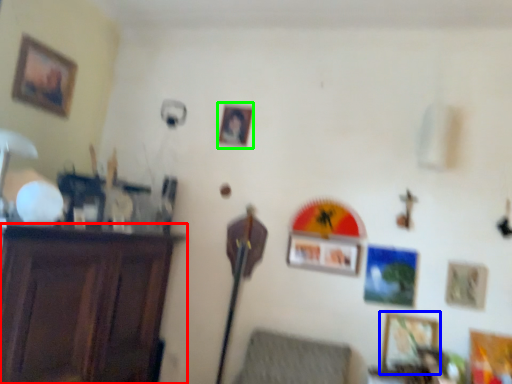
Question: Based on their relative distances, which object is farther from furniture (highlighted by a red box)? Choose from picture frame (highlighted by a blue box) and picture frame (highlighted by a green box).

Choices:
 (A) picture frame
 (B) picture frame

Answer: (A)